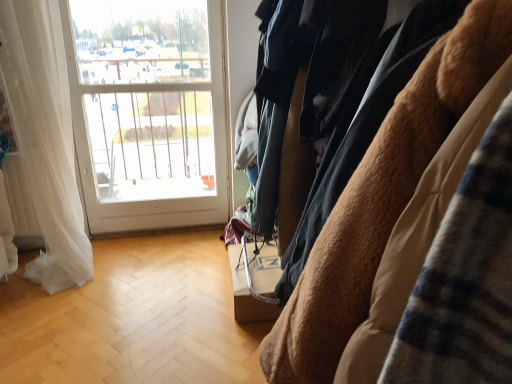
Question: In terms of width, does white glass window at upper left look wider or thinner when compared to brown fuzzy coat at right?

Choices:
 (A) wide
 (B) thin

Answer: (B)

Question: In the image, is white glass window at upper left positioned in front of or behind brown fuzzy coat at right?

Choices:
 (A) behind
 (B) front

Answer: (A)

Question: Which is nearer to the white glass window at upper left?

Choices:
 (A) white sheer curtain at left
 (B) brown fuzzy coat at right

Answer: (A)

Question: Which object is the farthest from the brown fuzzy coat at right?

Choices:
 (A) white sheer curtain at left
 (B) white glass window at upper left

Answer: (B)